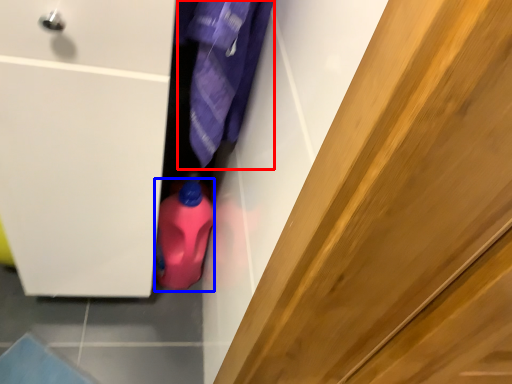
Question: Which object is further to the camera taking this photo, clothing (highlighted by a red box) or cleaning product (highlighted by a blue box)?

Choices:
 (A) clothing
 (B) cleaning product

Answer: (B)